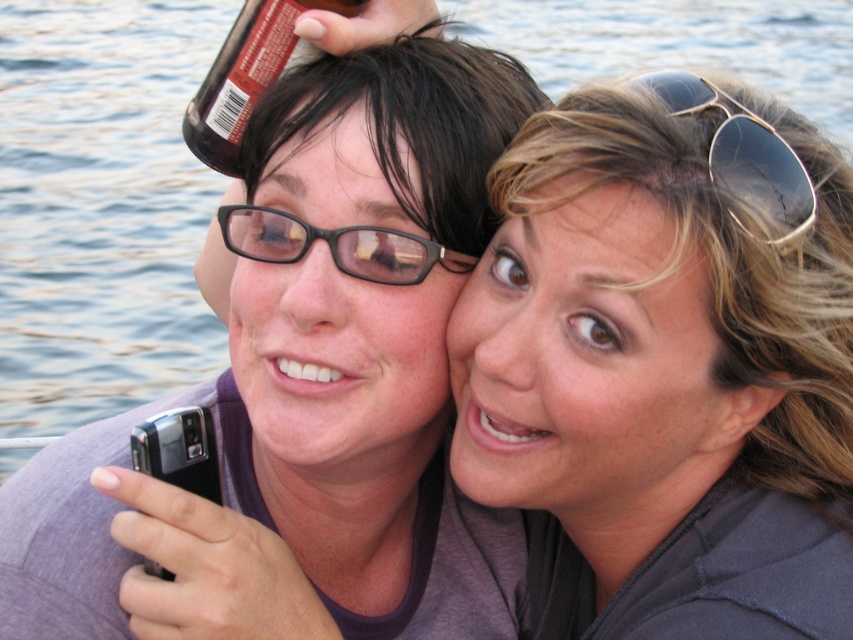
Which of these two, blonde hair at upper right or sunglasses at upper right, stands shorter?

Standing shorter between the two is sunglasses at upper right.

Does blonde hair at upper right have a lesser height compared to sunglasses at upper right?

Incorrect, blonde hair at upper right's height does not fall short of sunglasses at upper right's.

Locate an element on the screen. blonde hair at upper right is located at coordinates (665, 365).

Find the location of a particular element. blonde hair at upper right is located at coordinates (665, 365).

Between point (828, 266) and point (20, 484), which one is positioned behind?

The point (20, 484) is more distant.

The width and height of the screenshot is (853, 640). I want to click on blonde hair at upper right, so click(x=665, y=365).

Between point (86, 461) and point (796, 246), which one is positioned behind?

Point (86, 461)

What do you see at coordinates (323, 362) in the screenshot? The width and height of the screenshot is (853, 640). I see `matte black phone at center` at bounding box center [323, 362].

Locate an element on the screen. matte black phone at center is located at coordinates pos(323,362).